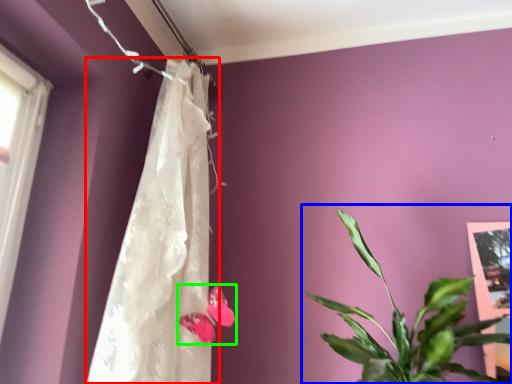
Question: Based on their relative distances, which object is farther from curtain (highlighted by a red box)? Choose from houseplant (highlighted by a blue box) and flower (highlighted by a green box).

Choices:
 (A) houseplant
 (B) flower

Answer: (A)